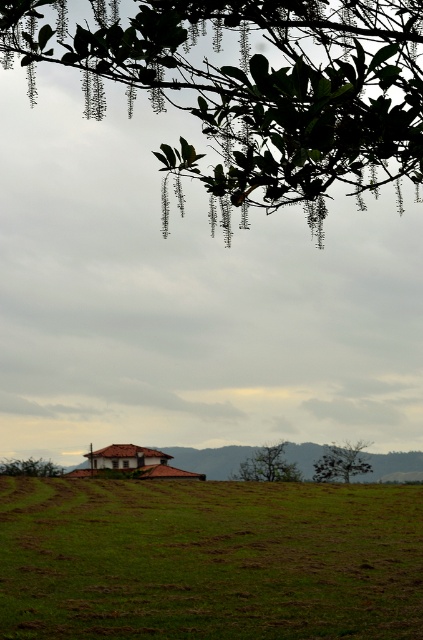
In the scene shown: Can you confirm if green grassy field at lower center is bigger than green leafy branches at upper center?

Yes, green grassy field at lower center is bigger than green leafy branches at upper center.

Is point (214, 584) in front of point (153, 72)?

No.

Is point (357, 566) more distant than point (379, 148)?

Yes, it is behind point (379, 148).

Where is `green grassy field at lower center`? The height and width of the screenshot is (640, 423). green grassy field at lower center is located at coordinates (208, 561).

Is point (183, 472) positioned after point (346, 472)?

Yes, it is behind point (346, 472).

Is point (132, 472) positioned behind point (323, 460)?

Yes, it is behind point (323, 460).

Find the location of a particular element. This screenshot has height=640, width=423. brown clay house at lower center is located at coordinates (131, 461).

I want to click on green matte tree at center, so click(269, 465).

Between point (249, 461) and point (46, 460), which one is positioned in front?

Positioned in front is point (249, 461).

Where is `green matte tree at center`? Image resolution: width=423 pixels, height=640 pixels. green matte tree at center is located at coordinates (269, 465).